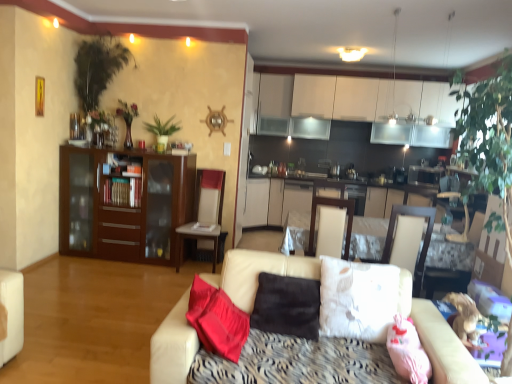
Question: Is leather couch at center at the back of green leafy plant at upper center?

Choices:
 (A) yes
 (B) no

Answer: (B)

Question: From a real-world perspective, is green leafy plant at upper center positioned under leather couch at center based on gravity?

Choices:
 (A) no
 (B) yes

Answer: (A)

Question: From a real-world perspective, is green leafy plant at upper center on leather couch at center?

Choices:
 (A) yes
 (B) no

Answer: (A)

Question: Does green leafy plant at upper center have a lesser width compared to leather couch at center?

Choices:
 (A) no
 (B) yes

Answer: (B)

Question: Could you tell me if green leafy plant at upper center is facing leather couch at center?

Choices:
 (A) yes
 (B) no

Answer: (B)

Question: From the image's perspective, is green leafy plant at upper center over leather couch at center?

Choices:
 (A) no
 (B) yes

Answer: (B)

Question: Is white leather chair at center smaller than leather couch at center?

Choices:
 (A) no
 (B) yes

Answer: (B)

Question: Is white leather chair at center facing towards leather couch at center?

Choices:
 (A) yes
 (B) no

Answer: (B)

Question: Is leather couch at center surrounded by white leather chair at center?

Choices:
 (A) no
 (B) yes

Answer: (A)

Question: From a real-world perspective, is white leather chair at center on top of leather couch at center?

Choices:
 (A) no
 (B) yes

Answer: (B)

Question: Does white leather chair at center appear on the left side of leather couch at center?

Choices:
 (A) no
 (B) yes

Answer: (B)

Question: Is white leather chair at center taller than leather couch at center?

Choices:
 (A) yes
 (B) no

Answer: (A)

Question: Does white leather chair at center appear on the right side of brown suede pillow at center, the first pillow viewed from the left?

Choices:
 (A) no
 (B) yes

Answer: (A)